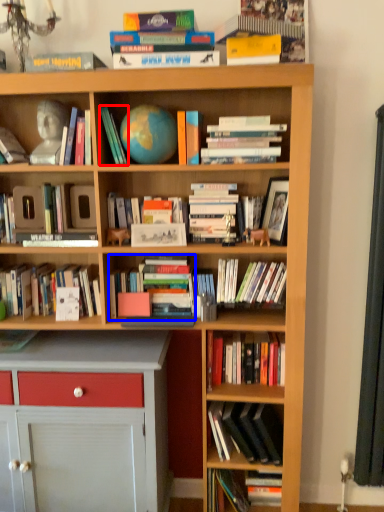
Question: Among these objects, which one is nearest to the camera, book (highlighted by a red box) or book (highlighted by a blue box)?

Choices:
 (A) book
 (B) book

Answer: (A)